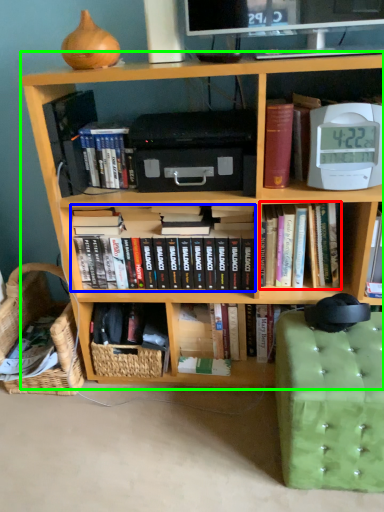
Question: Based on their relative distances, which object is farther from book (highlighted by a red box)? Choose from book (highlighted by a blue box) and bookcase (highlighted by a green box).

Choices:
 (A) book
 (B) bookcase

Answer: (A)